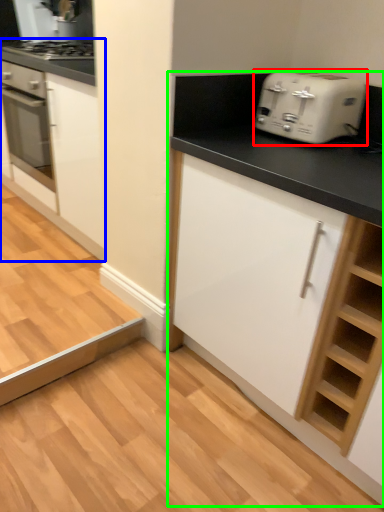
Question: Considering the real-world distances, which object is closest to toaster (highlighted by a red box)? cabinetry (highlighted by a blue box) or cabinetry (highlighted by a green box).

Choices:
 (A) cabinetry
 (B) cabinetry

Answer: (B)